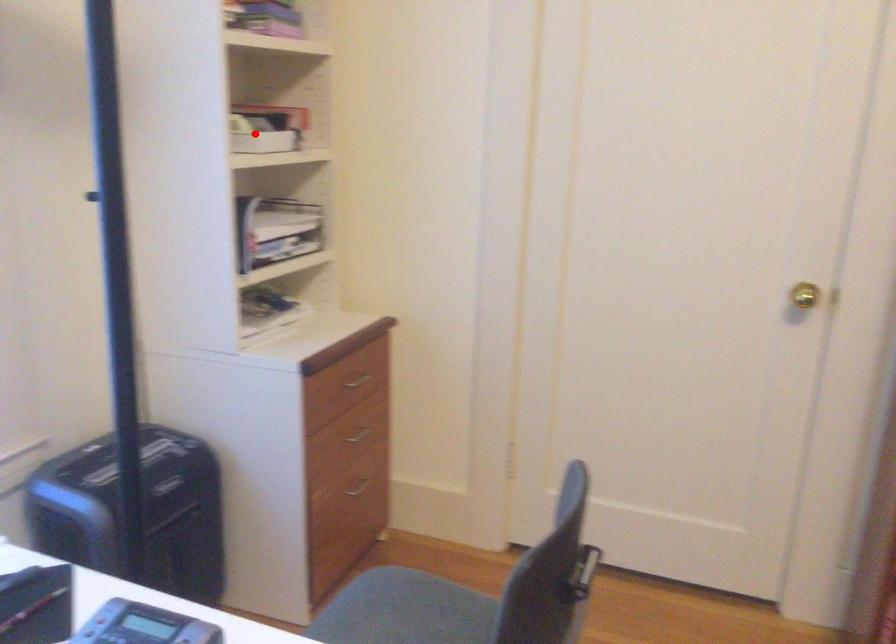
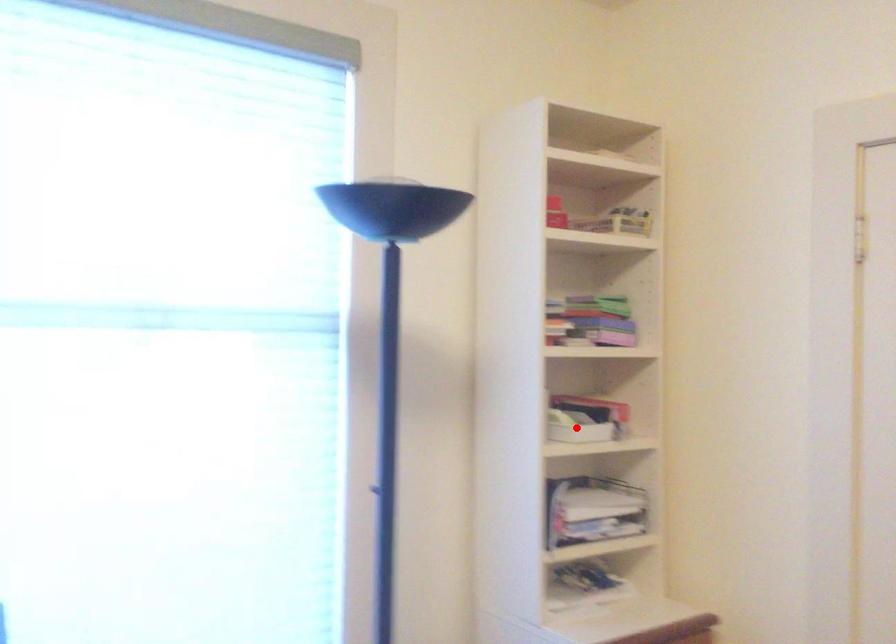
I am providing you with two images of the same scene from different viewpoints. A red point is marked on the first image and another point is marked on the second image. Does the point marked in image1 correspond to the same location as the one in image2?

Yes